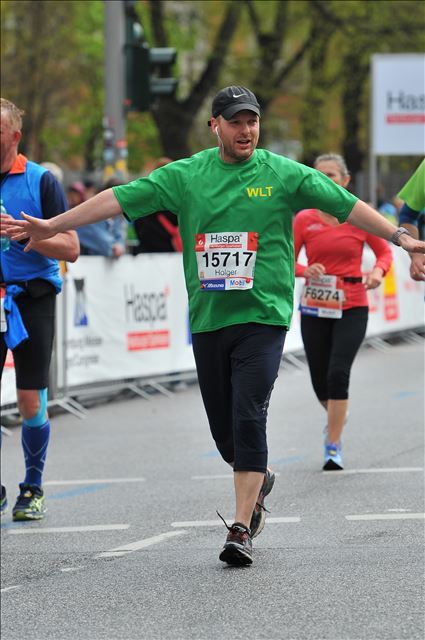
Where is `white poster`? The height and width of the screenshot is (640, 425). white poster is located at coordinates (99, 303).